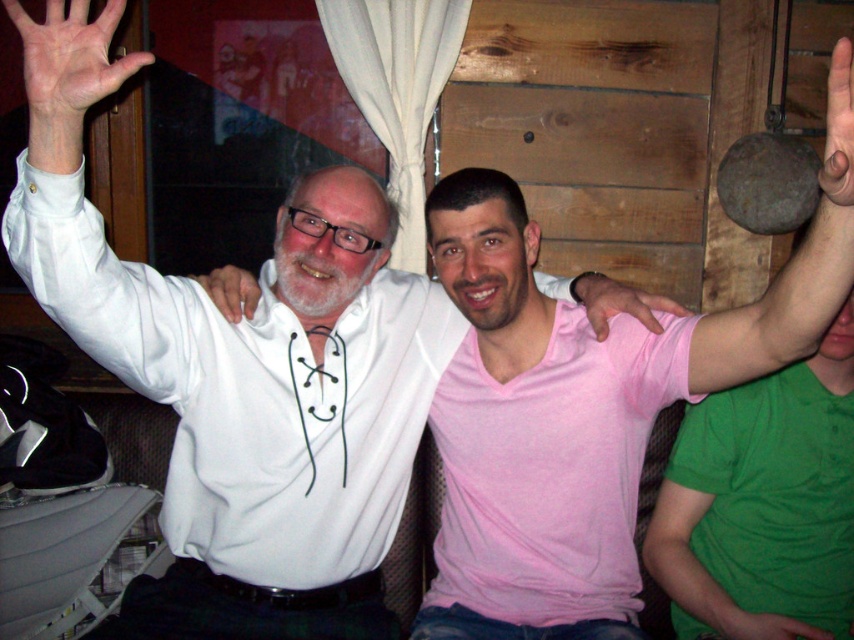
Question: Which of the following is the closest to the observer?

Choices:
 (A) green matte hand at lower right
 (B) green cotton shirt at right

Answer: (A)

Question: Is pink matte hand at center thinner than white lace-up shirt at upper center?

Choices:
 (A) no
 (B) yes

Answer: (A)

Question: Estimate the real-world distances between objects in this image. Which object is farther from the pink matte hand at center?

Choices:
 (A) pink matte hand at upper right
 (B) green cotton shirt at right
 (C) green matte hand at lower right
 (D) white lace-up shirt at upper center

Answer: (D)

Question: Can you confirm if pink matte hand at upper right is positioned below white lace-up shirt at upper center?

Choices:
 (A) no
 (B) yes

Answer: (A)

Question: Is pink matte hand at center closer to the viewer compared to white lace-up shirt at upper center?

Choices:
 (A) yes
 (B) no

Answer: (A)

Question: Which point is farther from the camera taking this photo?

Choices:
 (A) (10, 1)
 (B) (741, 321)
 (C) (843, 109)
 (D) (798, 632)

Answer: (D)